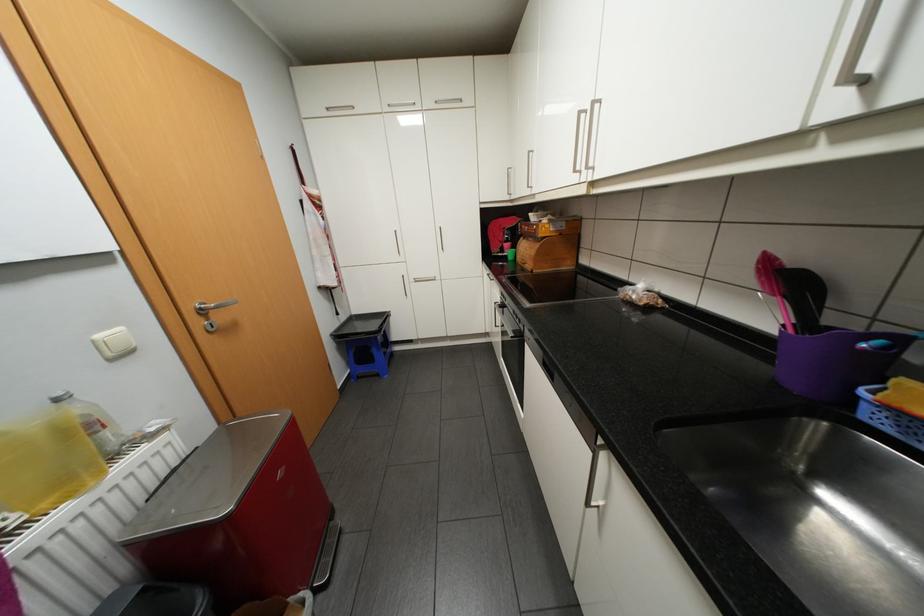
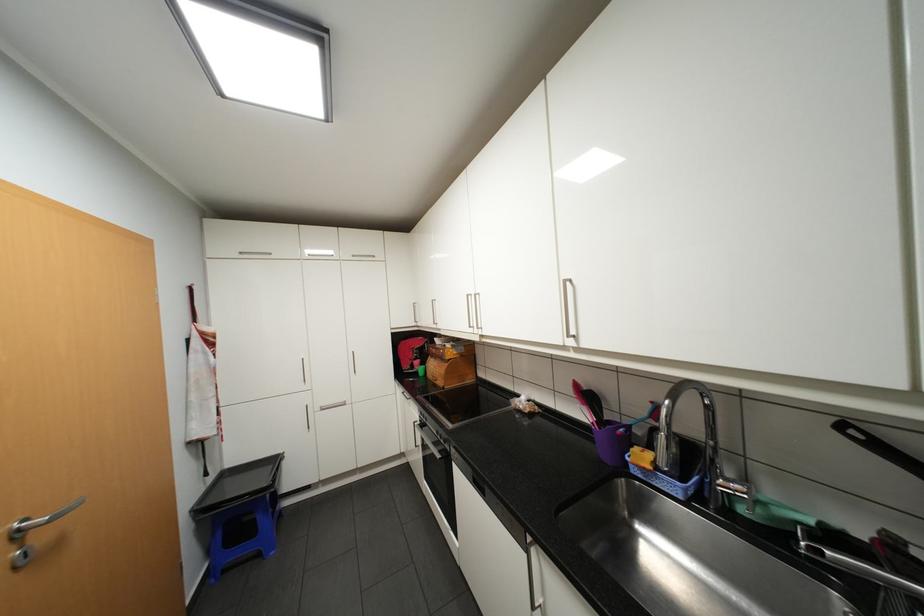
In the second image, find the point that corresponds to [800,283] in the first image.

(597, 397)